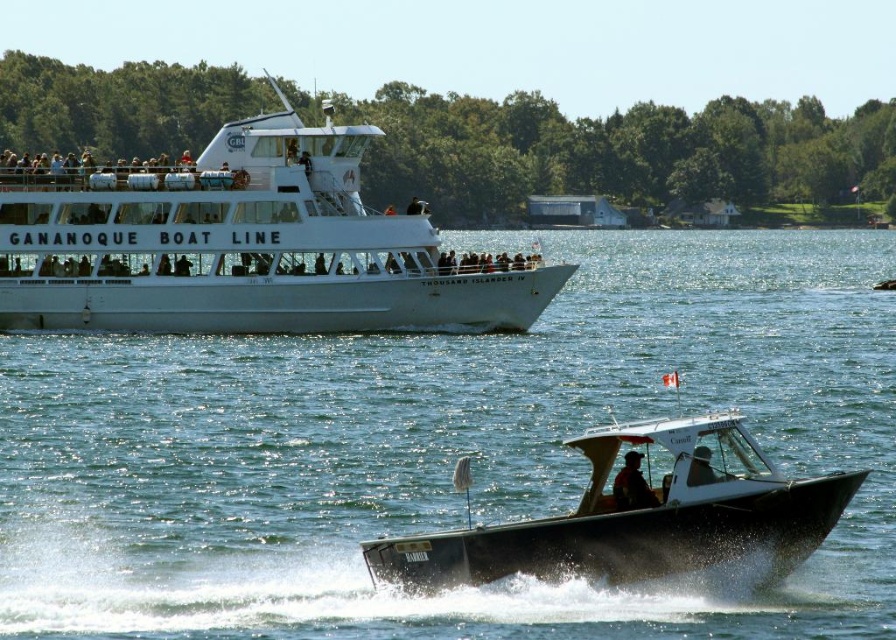
You are a photographer planning to take a photo of the clear blue water at center and the metallic gray boat at lower center. Based on their positions, which one should you focus on first to ensure it appears sharp in your photo?

The clear blue water at center is in front of the metallic gray boat at lower center, so you should focus on the clear blue water at center first to ensure it appears sharp in your photo.